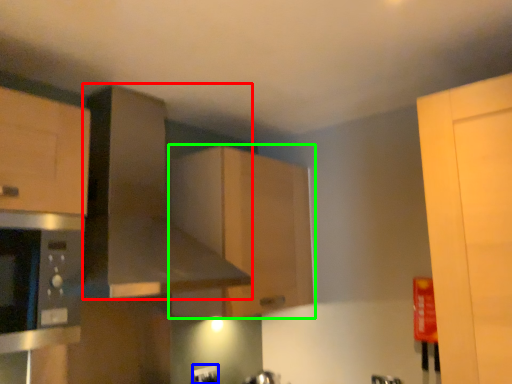
Question: Which object is the farthest from exhaust hood (highlighted by a red box)? Choose among these: electric outlet (highlighted by a blue box) or cabinetry (highlighted by a green box).

Choices:
 (A) electric outlet
 (B) cabinetry

Answer: (A)